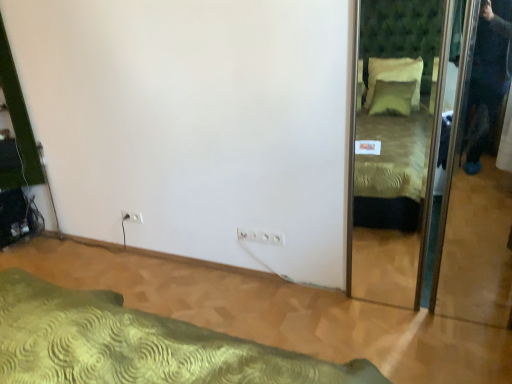
Question: Is the depth of white plastic electric outlet at lower left, positioned as the 1th electric outlet in top-to-bottom order, greater than that of green textured mirror at right?

Choices:
 (A) yes
 (B) no

Answer: (A)

Question: Is white plastic electric outlet at lower left, the 1th electric outlet from the back, located outside green textured mirror at right?

Choices:
 (A) no
 (B) yes

Answer: (B)

Question: From the image's perspective, is white plastic electric outlet at lower left, marked as the 2th electric outlet in a right-to-left arrangement, on top of green textured mirror at right?

Choices:
 (A) no
 (B) yes

Answer: (A)

Question: Can you confirm if white plastic electric outlet at lower left, positioned as the 1th electric outlet in top-to-bottom order, is bigger than green textured mirror at right?

Choices:
 (A) no
 (B) yes

Answer: (A)

Question: Can you confirm if white plastic electric outlet at lower left, marked as the 2th electric outlet in a right-to-left arrangement, is shorter than green textured mirror at right?

Choices:
 (A) no
 (B) yes

Answer: (B)

Question: From their relative heights in the image, would you say white plastic electric outlet at lower left, positioned as the 1th electric outlet in top-to-bottom order, is taller or shorter than green textured bed at lower left?

Choices:
 (A) tall
 (B) short

Answer: (A)

Question: Considering the positions of point (138, 211) and point (198, 382), is point (138, 211) closer or farther from the camera than point (198, 382)?

Choices:
 (A) closer
 (B) farther

Answer: (B)

Question: Considering the positions of white plastic electric outlet at lower left, marked as the 2th electric outlet in a right-to-left arrangement, and green textured bed at lower left in the image, is white plastic electric outlet at lower left, marked as the 2th electric outlet in a right-to-left arrangement, bigger or smaller than green textured bed at lower left?

Choices:
 (A) big
 (B) small

Answer: (B)

Question: Is white plastic electric outlet at lower left, the 1th electric outlet from the back, in front of or behind green textured bed at lower left in the image?

Choices:
 (A) front
 (B) behind

Answer: (B)

Question: Which is correct: white plastic electric outlet at lower left, the 1th electric outlet from the back, is inside green textured mirror at right, or outside of it?

Choices:
 (A) inside
 (B) outside

Answer: (B)

Question: Is white plastic electric outlet at lower left, the 1th electric outlet when ordered from left to right, to the left or to the right of green textured mirror at right in the image?

Choices:
 (A) right
 (B) left

Answer: (B)

Question: Based on their sizes in the image, would you say white plastic electric outlet at lower left, positioned as the 1th electric outlet in top-to-bottom order, is bigger or smaller than green textured mirror at right?

Choices:
 (A) big
 (B) small

Answer: (B)

Question: Considering the positions of point (138, 213) and point (411, 165), is point (138, 213) closer or farther from the camera than point (411, 165)?

Choices:
 (A) closer
 (B) farther

Answer: (A)

Question: In the image, is white plastic electric outlet at lower left, the 1th electric outlet from the back, positioned in front of or behind white plastic electric outlet at center, which ranks as the 2th electric outlet in left-to-right order?

Choices:
 (A) front
 (B) behind

Answer: (B)

Question: Is white plastic electric outlet at lower left, marked as the 2th electric outlet in a bottom-to-top arrangement, wider or thinner than white plastic electric outlet at center, which is counted as the 2th electric outlet, starting from the back?

Choices:
 (A) wide
 (B) thin

Answer: (B)